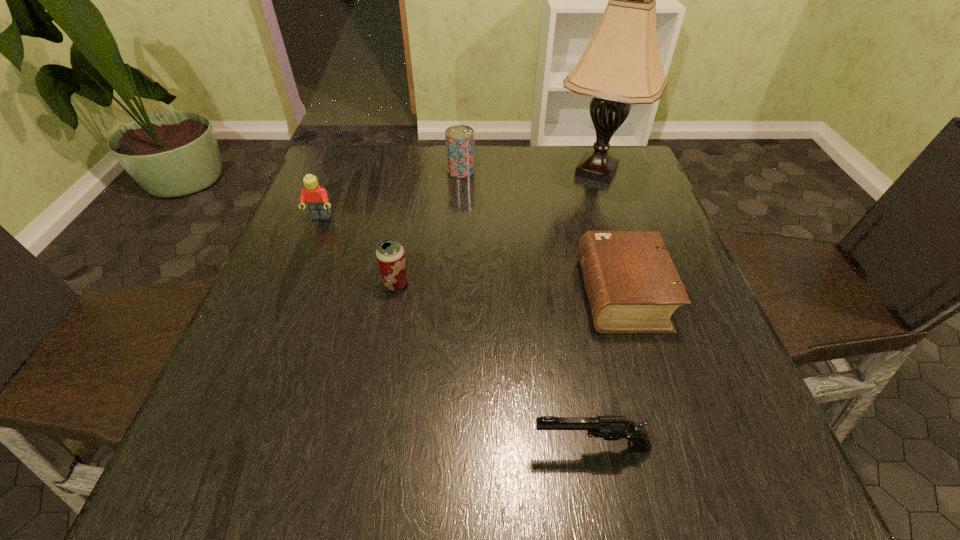
Locate an element on the screen. Image resolution: width=960 pixels, height=540 pixels. beer can at the far edge is located at coordinates (459, 139).

Where is `object located in the near edge section of the desktop`? The height and width of the screenshot is (540, 960). object located in the near edge section of the desktop is located at coordinates (612, 427).

Identify the location of object that is at the left edge. The width and height of the screenshot is (960, 540). (316, 197).

Where is `lamp that is at the right edge`? The height and width of the screenshot is (540, 960). lamp that is at the right edge is located at coordinates (621, 65).

Find the location of a particular element. Bible at the right edge is located at coordinates (632, 285).

Where is `object present at the far right corner`? object present at the far right corner is located at coordinates [621, 65].

Find the location of `blank space at the far edge`. blank space at the far edge is located at coordinates (558, 191).

I want to click on free location at the near edge, so click(414, 443).

Where is `free spot at the left edge of the desktop`? The height and width of the screenshot is (540, 960). free spot at the left edge of the desktop is located at coordinates (279, 361).

Where is `free location at the right edge of the desktop`? This screenshot has width=960, height=540. free location at the right edge of the desktop is located at coordinates (680, 363).